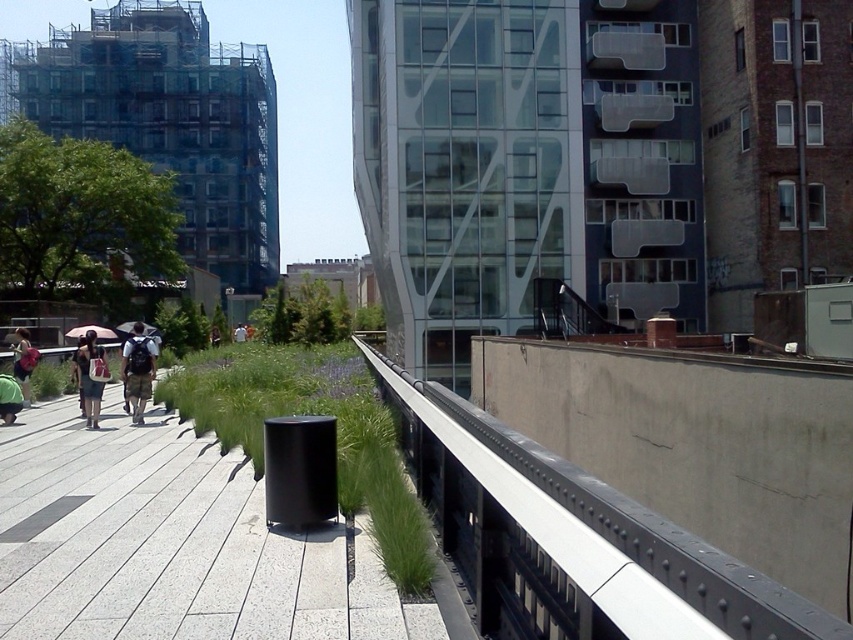
Question: Does metallic gray rail at center appear on the right side of green grass at center?

Choices:
 (A) yes
 (B) no

Answer: (A)

Question: Which point appears closest to the camera in this image?

Choices:
 (A) (77, 349)
 (B) (184, 397)
 (C) (148, 336)
 (D) (26, 378)

Answer: (A)

Question: Estimate the real-world distances between objects in this image. Which object is farther from the green grass at center?

Choices:
 (A) white matte umbrella at upper left
 (B) metallic gray rail at center
 (C) white cotton shirt at center
 (D) pink fabric umbrella at upper left

Answer: (C)

Question: From the image, what is the correct spatial relationship of matte black backpack at center in relation to white cotton shirt at center?

Choices:
 (A) left
 (B) right

Answer: (B)

Question: Among these points, which one is farthest from the camera?

Choices:
 (A) (22, 388)
 (B) (241, 337)
 (C) (128, 330)

Answer: (B)

Question: Can you confirm if matte black backpack at center is thinner than denim jacket at left?

Choices:
 (A) yes
 (B) no

Answer: (B)